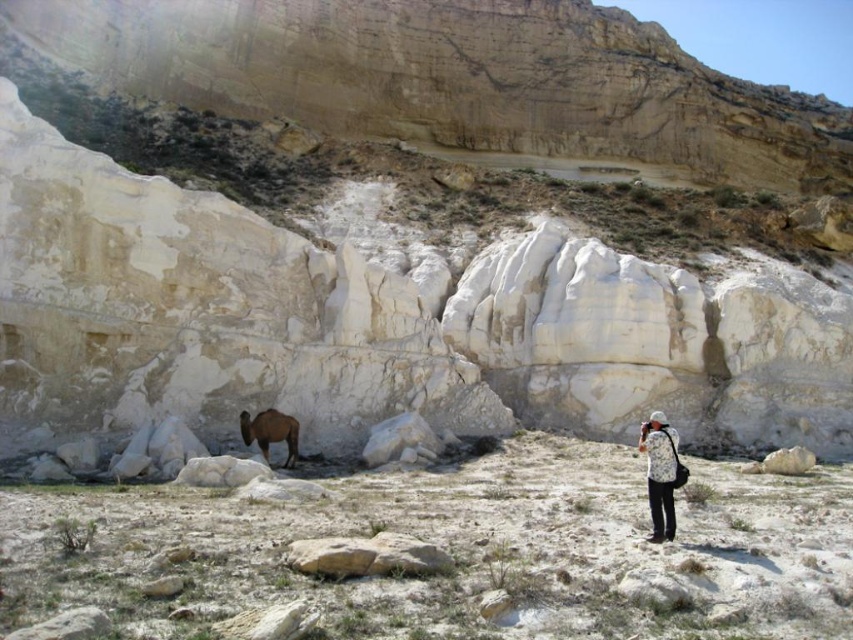
You are a traveler in this desert scene. You need to reach the oasis located at the brown dirt at center, which is your only source of water. Your camel, the brown fuzzy camel at lower left, can carry you 100 feet before needing water. Can your camel safely take you to the oasis without running out of stamina?

The brown dirt at center is 85.79 feet from the brown fuzzy camel at lower left. Since the camel can travel 100 feet before needing water, it can safely take you to the oasis as the distance is within its stamina limit.